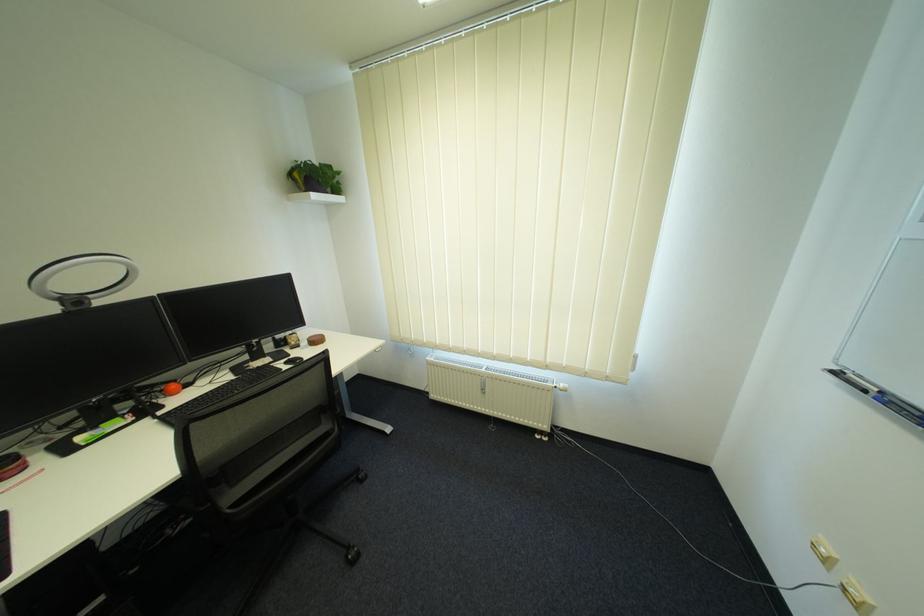
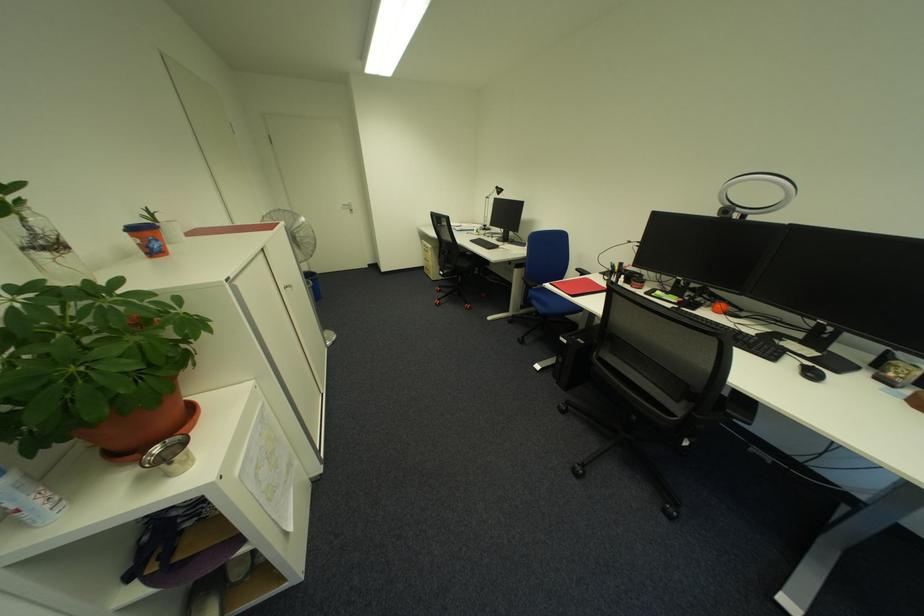
Locate, in the second image, the point that corresponds to [308,362] in the first image.

(820, 376)